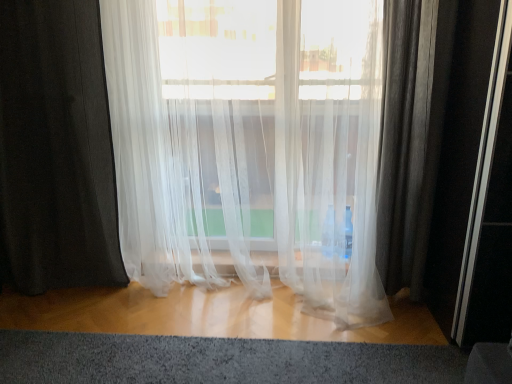
How much space does black sheer curtain at left, the second curtain when ordered from right to left, occupy vertically?

black sheer curtain at left, the second curtain when ordered from right to left, is 1.54 meters in height.

Where is `translucent white curtain at center, the 1th curtain when ordered from right to left`? Image resolution: width=512 pixels, height=384 pixels. translucent white curtain at center, the 1th curtain when ordered from right to left is located at coordinates [x=249, y=145].

At what (x,y) coordinates should I click in order to perform the action: click on textured gray carpet at lower center. Please return your answer as a coordinate pair (x, y). Looking at the image, I should click on (217, 360).

How far apart are textured gray carpet at lower center and black sheer curtain at left, the 1th curtain viewed from the left?

36.79 inches.

How different are the orientations of textured gray carpet at lower center and black sheer curtain at left, the second curtain when ordered from right to left, in degrees?

The facing directions of textured gray carpet at lower center and black sheer curtain at left, the second curtain when ordered from right to left, are 2.58 degrees apart.

From a real-world perspective, between textured gray carpet at lower center and black sheer curtain at left, the second curtain when ordered from right to left, who is vertically higher?

black sheer curtain at left, the second curtain when ordered from right to left.

Which of these two, textured gray carpet at lower center or black sheer curtain at left, the 1th curtain viewed from the left, is smaller?

textured gray carpet at lower center is smaller.

From their relative heights in the image, would you say black sheer curtain at left, the second curtain when ordered from right to left, is taller or shorter than textured gray carpet at lower center?

In the image, black sheer curtain at left, the second curtain when ordered from right to left, appears to be taller than textured gray carpet at lower center.

Considering the sizes of objects black sheer curtain at left, the second curtain when ordered from right to left, and textured gray carpet at lower center in the image provided, who is wider, black sheer curtain at left, the second curtain when ordered from right to left, or textured gray carpet at lower center?

Wider between the two is textured gray carpet at lower center.

In the scene shown: From a real-world perspective, between black sheer curtain at left, the 1th curtain viewed from the left, and textured gray carpet at lower center, who is vertically higher?

black sheer curtain at left, the 1th curtain viewed from the left, from a real-world perspective.

Is textured gray carpet at lower center at the back of black sheer curtain at left, the 1th curtain viewed from the left?

No.

Based on the photo, how much distance is there between translucent white curtain at center, the 1th curtain when ordered from right to left, and textured gray carpet at lower center?

A distance of 33.47 inches exists between translucent white curtain at center, the 1th curtain when ordered from right to left, and textured gray carpet at lower center.

Which is more to the left, translucent white curtain at center, the 1th curtain when ordered from right to left, or textured gray carpet at lower center?

translucent white curtain at center, the 1th curtain when ordered from right to left.

From the image's perspective, is translucent white curtain at center, the 1th curtain when ordered from right to left, above or below textured gray carpet at lower center?

translucent white curtain at center, the 1th curtain when ordered from right to left, is situated higher than textured gray carpet at lower center in the image.

Considering the relative sizes of translucent white curtain at center, which is the 2th curtain from left to right, and textured gray carpet at lower center in the image provided, is translucent white curtain at center, which is the 2th curtain from left to right, smaller than textured gray carpet at lower center?

No, translucent white curtain at center, which is the 2th curtain from left to right, is not smaller than textured gray carpet at lower center.

In the scene shown: Considering the relative positions of black sheer curtain at left, the second curtain when ordered from right to left, and translucent white curtain at center, the 1th curtain when ordered from right to left, in the image provided, is black sheer curtain at left, the second curtain when ordered from right to left, to the left of translucent white curtain at center, the 1th curtain when ordered from right to left, from the viewer's perspective?

Correct, you'll find black sheer curtain at left, the second curtain when ordered from right to left, to the left of translucent white curtain at center, the 1th curtain when ordered from right to left.

Can you confirm if black sheer curtain at left, the 1th curtain viewed from the left, is taller than translucent white curtain at center, which is the 2th curtain from left to right?

Indeed, black sheer curtain at left, the 1th curtain viewed from the left, has a greater height compared to translucent white curtain at center, which is the 2th curtain from left to right.

Which of these two, black sheer curtain at left, the second curtain when ordered from right to left, or translucent white curtain at center, the 1th curtain when ordered from right to left, is wider?

translucent white curtain at center, the 1th curtain when ordered from right to left, is wider.

There is a translucent white curtain at center, the 1th curtain when ordered from right to left. Where is `curtain above it (from a real-world perspective)`? curtain above it (from a real-world perspective) is located at coordinates (56, 150).

How different are the orientations of translucent white curtain at center, which is the 2th curtain from left to right, and black sheer curtain at left, the 1th curtain viewed from the left, in degrees?

They differ by 0.000163 degrees in their facing directions.

From a real-world perspective, relative to black sheer curtain at left, the second curtain when ordered from right to left, is translucent white curtain at center, the 1th curtain when ordered from right to left, vertically above or below?

From a real-world perspective, translucent white curtain at center, the 1th curtain when ordered from right to left, is physically below black sheer curtain at left, the second curtain when ordered from right to left.

Is translucent white curtain at center, which is the 2th curtain from left to right, not within black sheer curtain at left, the second curtain when ordered from right to left?

Yes, translucent white curtain at center, which is the 2th curtain from left to right, is outside of black sheer curtain at left, the second curtain when ordered from right to left.

Is translucent white curtain at center, which is the 2th curtain from left to right, shorter than black sheer curtain at left, the 1th curtain viewed from the left?

Correct, translucent white curtain at center, which is the 2th curtain from left to right, is not as tall as black sheer curtain at left, the 1th curtain viewed from the left.

You are a GUI agent. You are given a task and a screenshot of the screen. Output one action in this format:
    pyautogui.click(x=<x>, y=<y>)
    Task: Click on the gray that appears below the translucent white curtain at center, which is the 2th curtain from left to right (from a real-world perspective)
    
    Given the screenshot: What is the action you would take?
    pyautogui.click(x=217, y=360)

Is textured gray carpet at lower center bigger or smaller than translucent white curtain at center, the 1th curtain when ordered from right to left?

Considering their sizes, textured gray carpet at lower center takes up less space than translucent white curtain at center, the 1th curtain when ordered from right to left.

Based on the photo, which of these two, textured gray carpet at lower center or translucent white curtain at center, the 1th curtain when ordered from right to left, is wider?

Wider between the two is textured gray carpet at lower center.

Could translucent white curtain at center, which is the 2th curtain from left to right, be considered to be inside textured gray carpet at lower center?

Definitely not — translucent white curtain at center, which is the 2th curtain from left to right, is not inside textured gray carpet at lower center.

This screenshot has width=512, height=384. Identify the location of the 2nd curtain to the left when counting from the textured gray carpet at lower center. (56, 150).

I want to click on gray that is under the black sheer curtain at left, the 1th curtain viewed from the left (from a real-world perspective), so click(217, 360).

Based on their spatial positions, is textured gray carpet at lower center or black sheer curtain at left, the second curtain when ordered from right to left, further from translucent white curtain at center, which is the 2th curtain from left to right?

textured gray carpet at lower center is further to translucent white curtain at center, which is the 2th curtain from left to right.

Looking at the image, which one is located further to textured gray carpet at lower center, translucent white curtain at center, which is the 2th curtain from left to right, or black sheer curtain at left, the 1th curtain viewed from the left?

Among the two, black sheer curtain at left, the 1th curtain viewed from the left, is located further to textured gray carpet at lower center.

Estimate the real-world distances between objects in this image. Which object is closer to black sheer curtain at left, the 1th curtain viewed from the left, textured gray carpet at lower center or translucent white curtain at center, which is the 2th curtain from left to right?

Based on the image, translucent white curtain at center, which is the 2th curtain from left to right, appears to be nearer to black sheer curtain at left, the 1th curtain viewed from the left.

From the image, which object appears to be farther from textured gray carpet at lower center, black sheer curtain at left, the 1th curtain viewed from the left, or translucent white curtain at center, the 1th curtain when ordered from right to left?

black sheer curtain at left, the 1th curtain viewed from the left, is further to textured gray carpet at lower center.

Based on their spatial positions, is black sheer curtain at left, the 1th curtain viewed from the left, or textured gray carpet at lower center further from translucent white curtain at center, which is the 2th curtain from left to right?

textured gray carpet at lower center is positioned further to the anchor translucent white curtain at center, which is the 2th curtain from left to right.

Consider the image. From the image, which object appears to be farther from black sheer curtain at left, the 1th curtain viewed from the left, translucent white curtain at center, the 1th curtain when ordered from right to left, or textured gray carpet at lower center?

Based on the image, textured gray carpet at lower center appears to be further to black sheer curtain at left, the 1th curtain viewed from the left.

Locate an element on the screen. The image size is (512, 384). curtain between black sheer curtain at left, the 1th curtain viewed from the left, and textured gray carpet at lower center from left to right is located at coordinates (249, 145).